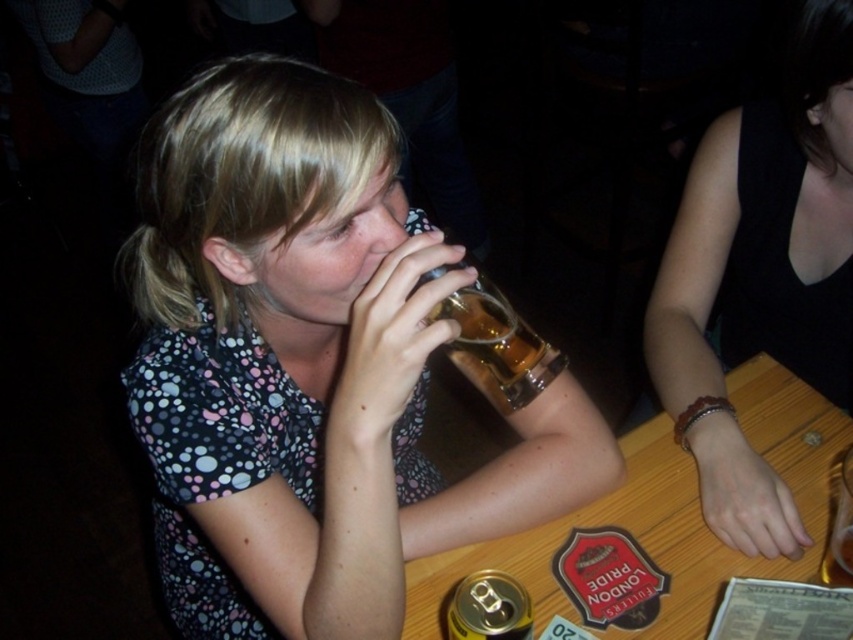
You are a bartender at the bar and you need to place a new drink order for the customer. The customer is sitting at the table with the matte glass mug at center and black matte tank top at upper right. Which object should you prioritize placing the drink near to ensure it is closest to the customer?

You should prioritize placing the drink near the matte glass mug at center because it is in front of the black matte tank top at upper right, making it closer to the customer.

You are a bartender who needs to place a new drink order on the table. The drink must be placed on the wooden table at center without covering the coaster. Given that the translucent glass mug at upper center is already occupying part of the table, can you fit the new drink on the remaining space?

The wooden table at center is larger in size than the translucent glass mug at upper center, so there is sufficient space remaining on the wooden table at center to place the new drink without covering the coaster.

You are a bartender at the bar and you need to place a new drink order. The drink must be placed on the table where the matte glass mug at center and the black matte tank top at upper right are located. Which object should you avoid placing the drink near to ensure it doesn

The black matte tank top at upper right should be avoided because the matte glass mug at center is bigger and might block access to the area near the black matte tank top at upper right.